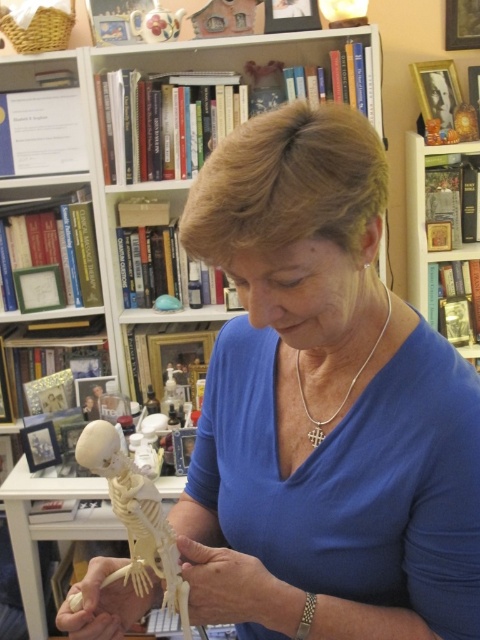
Can you confirm if translucent plastic hand at center is positioned to the left of silver cross at center?

Correct, you'll find translucent plastic hand at center to the left of silver cross at center.

Between translucent plastic hand at center and silver cross at center, which one has more height?

silver cross at center is taller.

Is point (115, 598) more distant than point (326, 420)?

No, it is not.

Locate an element on the screen. The width and height of the screenshot is (480, 640). translucent plastic hand at center is located at coordinates (105, 604).

Who is more forward, (132, 484) or (181, 572)?

Point (132, 484) is in front.

Is transparent plastic skeleton at lower left thinner than smooth skin hand at center?

In fact, transparent plastic skeleton at lower left might be wider than smooth skin hand at center.

Describe the element at coordinates (136, 518) in the screenshot. This screenshot has width=480, height=640. I see `transparent plastic skeleton at lower left` at that location.

Locate an element on the screen. transparent plastic skeleton at lower left is located at coordinates (136, 518).

Is transparent plastic skeleton at lower left smaller than translucent plastic hand at center?

No.

Does transparent plastic skeleton at lower left have a lesser width compared to translucent plastic hand at center?

Incorrect, transparent plastic skeleton at lower left's width is not less than translucent plastic hand at center's.

This screenshot has height=640, width=480. What do you see at coordinates (136, 518) in the screenshot?
I see `transparent plastic skeleton at lower left` at bounding box center [136, 518].

I want to click on transparent plastic skeleton at lower left, so click(x=136, y=518).